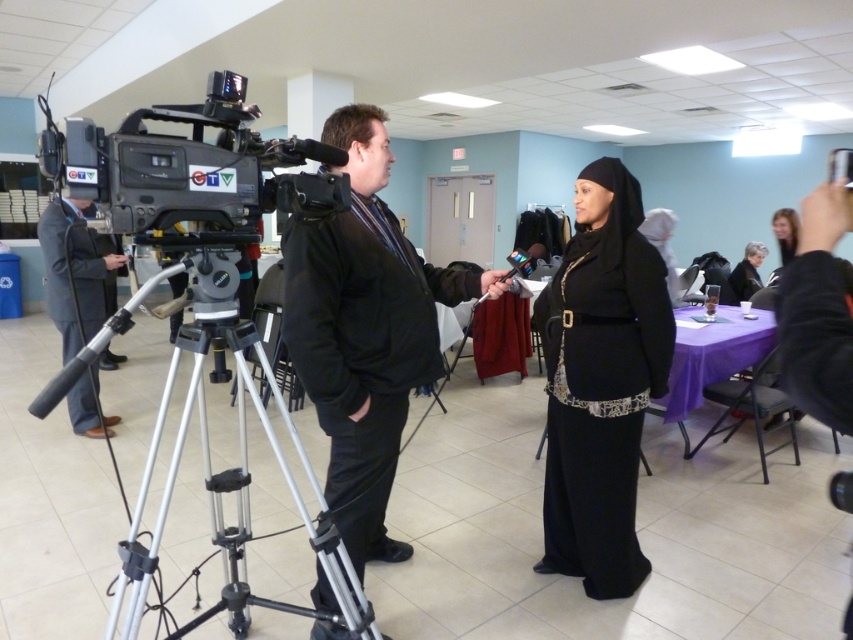
Question: From the image, what is the correct spatial relationship of matte black microphone at left in relation to black fabric hijab at upper right?

Choices:
 (A) left
 (B) right

Answer: (A)

Question: Which point appears farthest from the camera in this image?

Choices:
 (A) (770, 284)
 (B) (380, 529)
 (C) (239, 452)
 (D) (752, 292)

Answer: (D)

Question: Considering the real-world distances, which object is closest to the matte black microphone at left?

Choices:
 (A) black matte dress at center
 (B) black matte jacket at center
 (C) silver metallic tripod at center

Answer: (C)

Question: Considering the real-world distances, which object is farthest from the black fabric hijab at upper right?

Choices:
 (A) black matte jacket at center
 (B) matte black microphone at left
 (C) black matte dress at center
 (D) black velvet robe at center

Answer: (B)

Question: Does silver metallic tripod at center have a smaller size compared to matte black microphone at left?

Choices:
 (A) no
 (B) yes

Answer: (B)

Question: In this image, where is black matte dress at center located relative to black fabric hijab at upper right?

Choices:
 (A) right
 (B) left

Answer: (B)